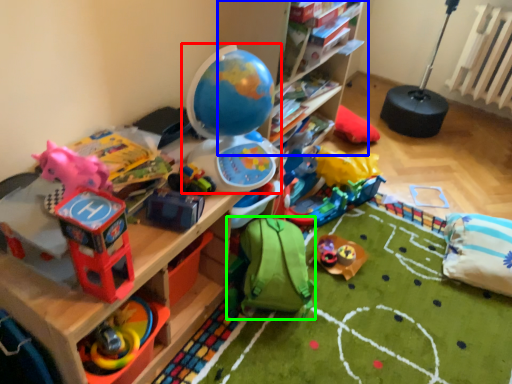
Question: Which is farther away from toy (highlighted by a red box)? shelf (highlighted by a blue box) or toy (highlighted by a green box)?

Choices:
 (A) shelf
 (B) toy

Answer: (A)